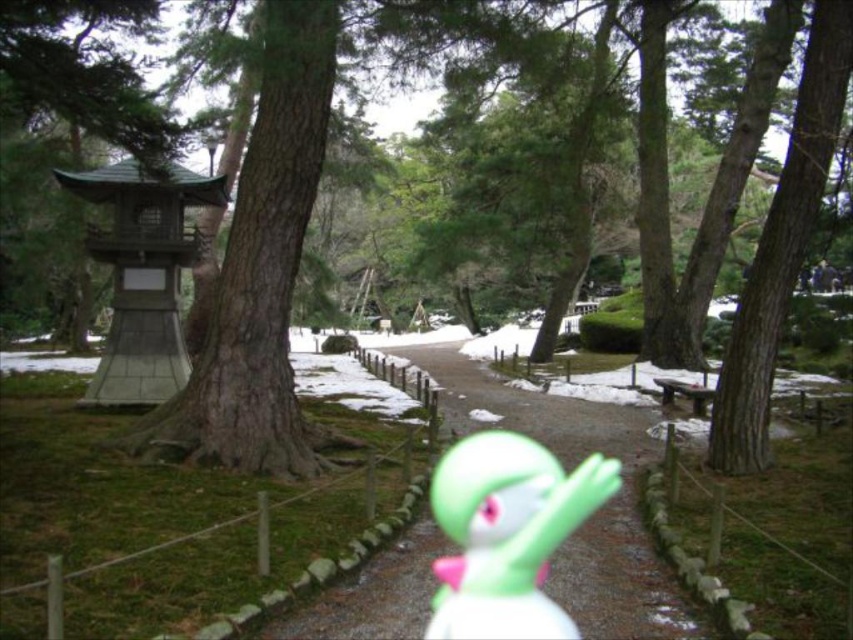
You are a visitor in the garden and want to place a snowman next to the green rubber toy at center. Where should you position the snowman relative to the smooth concrete path at center?

The smooth concrete path at center is to the right of the green rubber toy at center, so you should position the snowman to the left of the smooth concrete path at center to place it next to the green rubber toy at center.

You are a visitor in the garden and want to walk along the smooth concrete path at center. There is a green matte tree at center nearby. Which side of the path should you walk on to stay on the correct path?

The green matte tree at center is positioned on the left side of the smooth concrete path at center, so you should walk on the right side of the path to stay on the correct path.

You are a visitor in the garden and want to take a photo of the green matte tree at center and the green rubber toy at center. Which object should you focus on first if you want to capture both in a single frame without moving the camera?

The green rubber toy at center should be focused on first since it is shorter than the green matte tree at center, allowing both to be in the frame by adjusting the camera angle slightly downward.